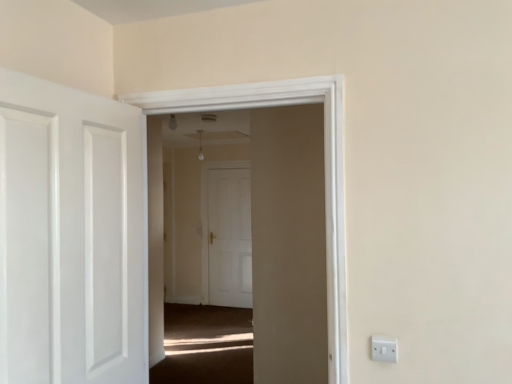
Question: Is white plastic switch at lower right not near white matte door at center, the 2th door viewed from the front?

Choices:
 (A) no
 (B) yes

Answer: (B)

Question: Is white plastic switch at lower right at the right side of white matte door at center, the 1th door viewed from the back?

Choices:
 (A) no
 (B) yes

Answer: (B)

Question: From a real-world perspective, is white plastic switch at lower right positioned over white matte door at center, the 1th door viewed from the back, based on gravity?

Choices:
 (A) no
 (B) yes

Answer: (B)

Question: Can you confirm if white plastic switch at lower right is smaller than white matte door at center, the 1th door viewed from the back?

Choices:
 (A) no
 (B) yes

Answer: (B)

Question: From the image's perspective, would you say white plastic switch at lower right is positioned over white matte door at center, the 1th door viewed from the back?

Choices:
 (A) yes
 (B) no

Answer: (A)

Question: Is point (132, 324) positioned closer to the camera than point (385, 354)?

Choices:
 (A) closer
 (B) farther

Answer: (B)

Question: In terms of width, does white glossy door at left, which is the 1th door from front to back, look wider or thinner when compared to white plastic switch at lower right?

Choices:
 (A) thin
 (B) wide

Answer: (B)

Question: Considering the positions of white glossy door at left, which is the 1th door from front to back, and white plastic switch at lower right in the image, is white glossy door at left, which is the 1th door from front to back, taller or shorter than white plastic switch at lower right?

Choices:
 (A) tall
 (B) short

Answer: (A)

Question: Would you say white glossy door at left, the 2th door from the back, is to the left or to the right of white plastic switch at lower right in the picture?

Choices:
 (A) right
 (B) left

Answer: (B)

Question: In terms of size, does white glossy door at left, which is the 1th door from front to back, appear bigger or smaller than white matte door at center, the 2th door viewed from the front?

Choices:
 (A) big
 (B) small

Answer: (A)

Question: Looking at their shapes, would you say white glossy door at left, the 2th door from the back, is wider or thinner than white matte door at center, the 1th door viewed from the back?

Choices:
 (A) thin
 (B) wide

Answer: (B)

Question: Relative to white matte door at center, the 2th door viewed from the front, is white glossy door at left, the 2th door from the back, in front or behind?

Choices:
 (A) front
 (B) behind

Answer: (A)

Question: Is white glossy door at left, the 2th door from the back, to the left or to the right of white matte door at center, the 1th door viewed from the back, in the image?

Choices:
 (A) right
 (B) left

Answer: (B)

Question: From the image's perspective, is white plastic switch at lower right located above or below white glossy door at left, which is the 1th door from front to back?

Choices:
 (A) below
 (B) above

Answer: (A)

Question: Is white plastic switch at lower right taller or shorter than white glossy door at left, which is the 1th door from front to back?

Choices:
 (A) short
 (B) tall

Answer: (A)